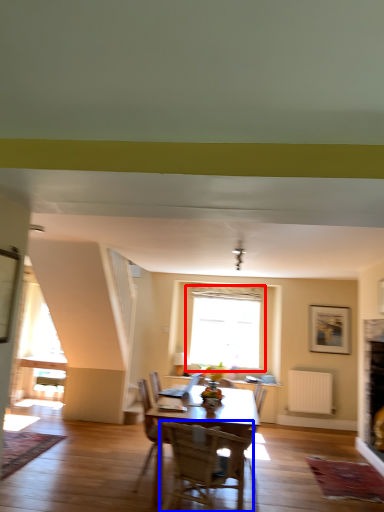
Question: Which object is closer to the camera taking this photo, window (highlighted by a red box) or chair (highlighted by a blue box)?

Choices:
 (A) window
 (B) chair

Answer: (B)